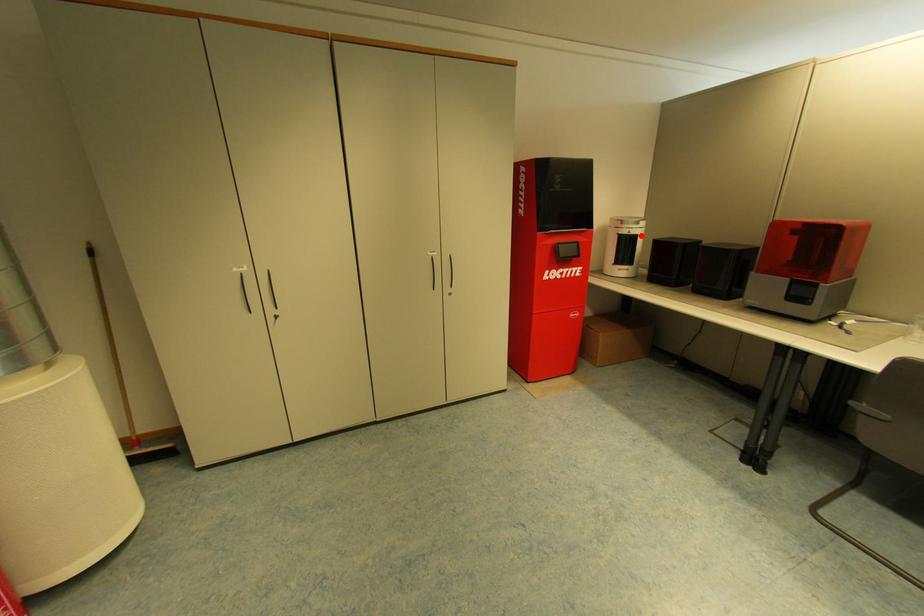
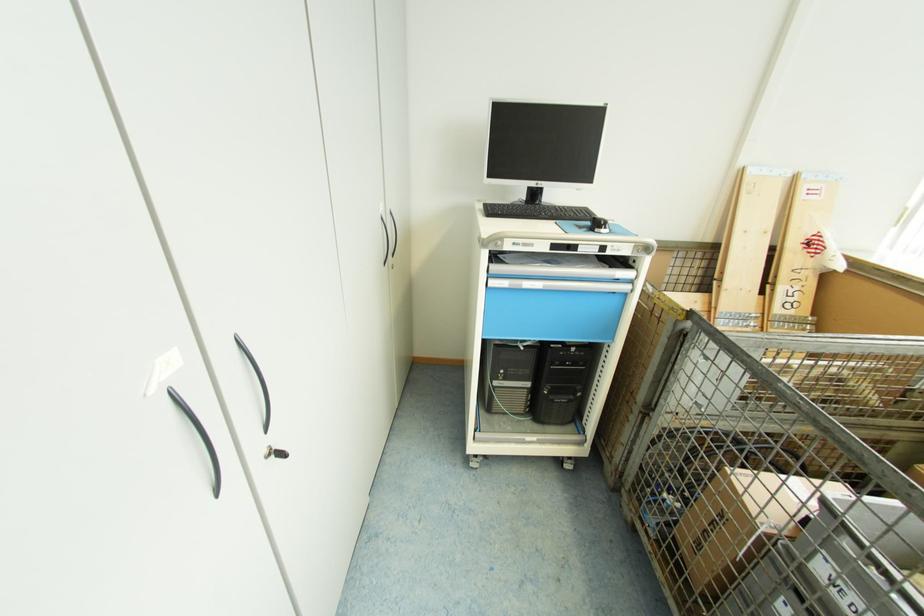
Question: I am providing you with two images of the same scene from different viewpoints. A red point is marked on the first image. At the location where the point appears in image 1, is it still visible in image 2?

Choices:
 (A) Yes
 (B) No

Answer: (B)